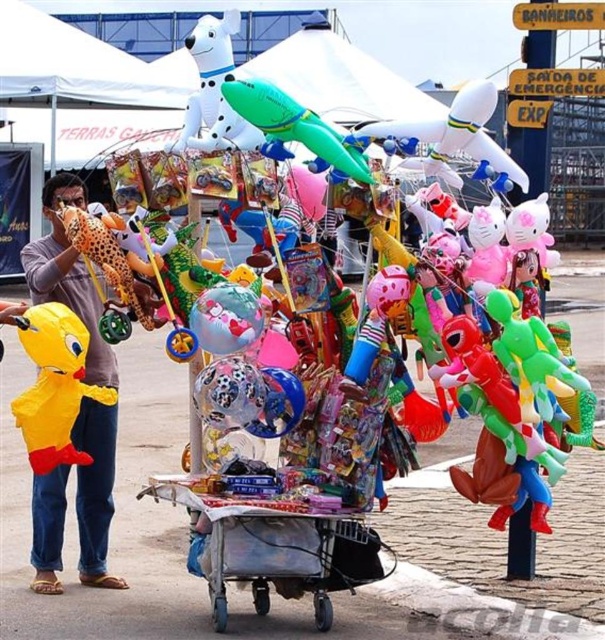
Based on the photo, you are a customer at the inflatable toy cart and want to pick up the yellow matte rubber duck at left and the white glossy dog at upper center. Which one do you need to reach further into the cart to get?

The white glossy dog at upper center requires reaching further into the cart because the yellow matte rubber duck at left is closer to you, while the white glossy dog at upper center is positioned further away.

You are a customer looking to buy an inflatable toy for your child. You see the white glossy dog at upper center and the green inflatable airplane at center. Which one is wider?

The white glossy dog at upper center is wider than the green inflatable airplane at center.